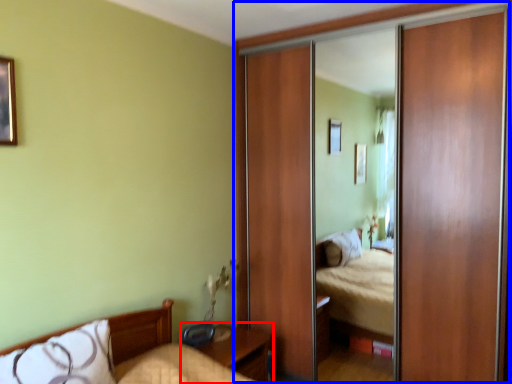
Question: Which of the following is the farthest to the observer, nightstand (highlighted by a red box) or glass door (highlighted by a blue box)?

Choices:
 (A) nightstand
 (B) glass door

Answer: (A)